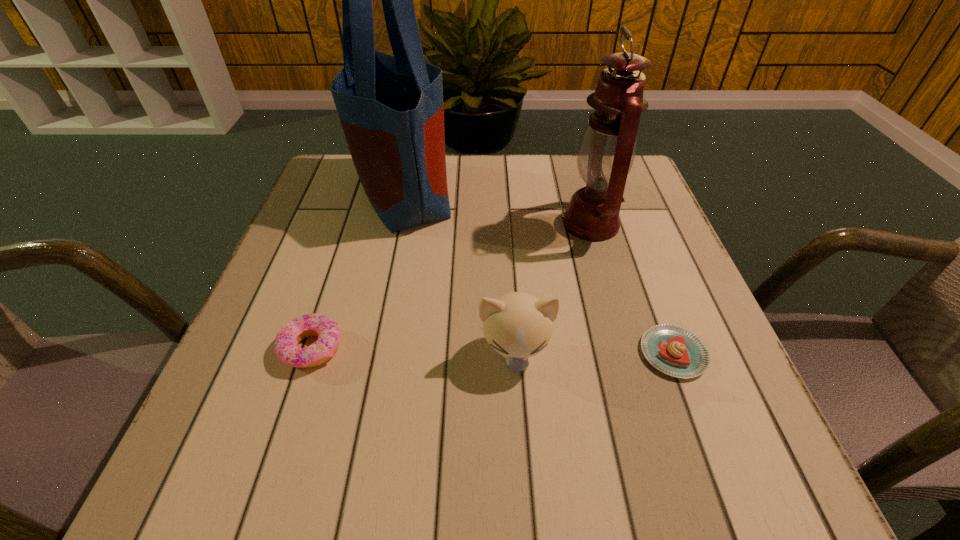
Locate an element on the screen. This screenshot has height=540, width=960. vacant space located on the back of the pastry is located at coordinates (617, 203).

Where is `handbag that is at the far edge`? The width and height of the screenshot is (960, 540). handbag that is at the far edge is located at coordinates (391, 109).

In order to click on oil lamp at the far edge in this screenshot , I will do `click(607, 149)`.

Locate an element on the screen. The width and height of the screenshot is (960, 540). handbag at the left edge is located at coordinates (391, 109).

Where is `doughnut situated at the left edge`? doughnut situated at the left edge is located at coordinates (286, 348).

Locate an element on the screen. oil lamp that is at the right edge is located at coordinates (607, 149).

Find the location of `pastry at the right edge`. pastry at the right edge is located at coordinates (675, 351).

Identify the location of object located in the far left corner section of the desktop. (391, 109).

The width and height of the screenshot is (960, 540). In order to click on object situated at the far right corner in this screenshot , I will do `click(607, 149)`.

The width and height of the screenshot is (960, 540). What are the coordinates of `free spot at the far edge of the desktop` in the screenshot? It's located at (492, 167).